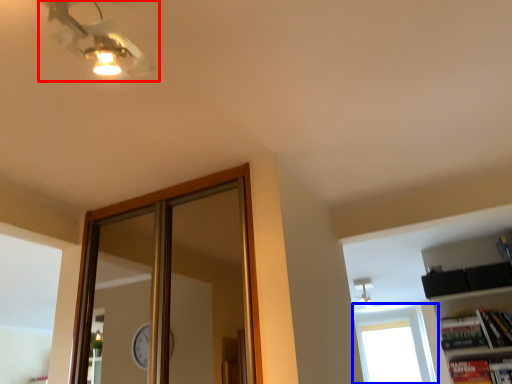
Question: Which point is further to the camera, fan (highlighted by a red box) or window (highlighted by a blue box)?

Choices:
 (A) fan
 (B) window

Answer: (B)